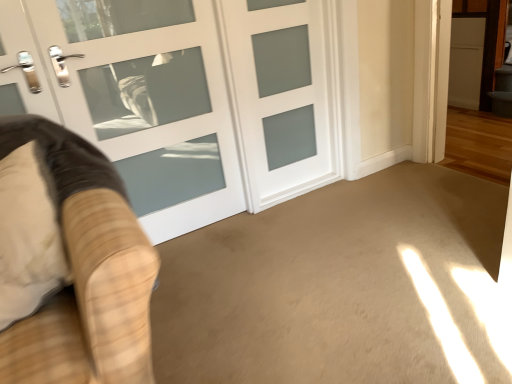
Question: Is point (263, 31) closer or farther from the camera than point (129, 9)?

Choices:
 (A) farther
 (B) closer

Answer: (A)

Question: Considering the positions of white frosted glass door at center, which is the 1th door in right-to-left order, and white frosted glass door at center, positioned as the 1th door in left-to-right order, in the image, is white frosted glass door at center, which is the 1th door in right-to-left order, bigger or smaller than white frosted glass door at center, positioned as the 1th door in left-to-right order,?

Choices:
 (A) small
 (B) big

Answer: (A)

Question: Which object is positioned closest to the white frosted glass door at center, the second door from the left?

Choices:
 (A) white frosted glass door at center, positioned as the 1th door in left-to-right order
 (B) beige carpet at center
 (C) velvet beige armchair at left

Answer: (A)

Question: Which object is positioned closest to the beige carpet at center?

Choices:
 (A) velvet beige armchair at left
 (B) white frosted glass door at center, positioned as the 2th door in right-to-left order
 (C) white frosted glass door at center, which is the 1th door in right-to-left order

Answer: (B)